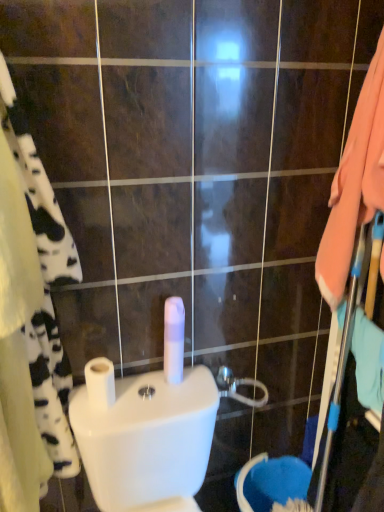
Question: Is metallic silver showerhead at center wider than white cotton bath towel at left?

Choices:
 (A) no
 (B) yes

Answer: (A)

Question: Considering the relative sizes of metallic silver showerhead at center and white cotton bath towel at left in the image provided, is metallic silver showerhead at center taller than white cotton bath towel at left?

Choices:
 (A) yes
 (B) no

Answer: (B)

Question: Is metallic silver showerhead at center facing towards white cotton bath towel at left?

Choices:
 (A) yes
 (B) no

Answer: (B)

Question: Is white cotton bath towel at left surrounded by metallic silver showerhead at center?

Choices:
 (A) no
 (B) yes

Answer: (A)

Question: Is metallic silver showerhead at center oriented away from white cotton bath towel at left?

Choices:
 (A) yes
 (B) no

Answer: (B)

Question: From their relative heights in the image, would you say metallic silver showerhead at center is taller or shorter than white cotton bath towel at left?

Choices:
 (A) short
 (B) tall

Answer: (A)

Question: Is metallic silver showerhead at center to the left or to the right of white cotton bath towel at left in the image?

Choices:
 (A) left
 (B) right

Answer: (B)

Question: Does point (246, 399) appear closer or farther from the camera than point (64, 407)?

Choices:
 (A) farther
 (B) closer

Answer: (A)

Question: Relative to white cotton bath towel at left, is metallic silver showerhead at center in front or behind?

Choices:
 (A) front
 (B) behind

Answer: (B)

Question: Relative to white matte toilet paper at center, acting as the first toilet paper starting from the right, is white cotton bath towel at left in front or behind?

Choices:
 (A) front
 (B) behind

Answer: (A)

Question: Visually, is white cotton bath towel at left positioned to the left or to the right of white matte toilet paper at center, the second toilet paper from the left?

Choices:
 (A) left
 (B) right

Answer: (A)

Question: Would you say white cotton bath towel at left is inside or outside white matte toilet paper at center, the second toilet paper from the left?

Choices:
 (A) inside
 (B) outside

Answer: (B)

Question: In terms of width, does white cotton bath towel at left look wider or thinner when compared to white matte toilet paper at center, acting as the first toilet paper starting from the right?

Choices:
 (A) thin
 (B) wide

Answer: (B)

Question: Considering their positions, is white cotton bath towel at left located in front of or behind white matte toilet paper at center, the 2th toilet paper viewed from the right?

Choices:
 (A) behind
 (B) front

Answer: (B)

Question: Based on their sizes in the image, would you say white cotton bath towel at left is bigger or smaller than white matte toilet paper at center, marked as the 1th toilet paper in a left-to-right arrangement?

Choices:
 (A) big
 (B) small

Answer: (A)